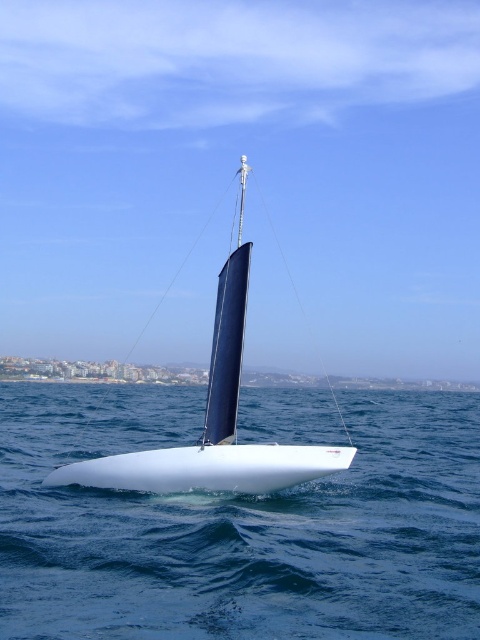
Who is higher up, white smooth water at center or blue glossy sail at center?

Positioned higher is blue glossy sail at center.

Is the position of white smooth water at center less distant than that of blue glossy sail at center?

Yes, white smooth water at center is closer to the viewer.

Measure the distance between white smooth water at center and camera.

The distance of white smooth water at center from camera is 6.04 meters.

This screenshot has width=480, height=640. In order to click on white smooth water at center in this screenshot , I will do `click(239, 525)`.